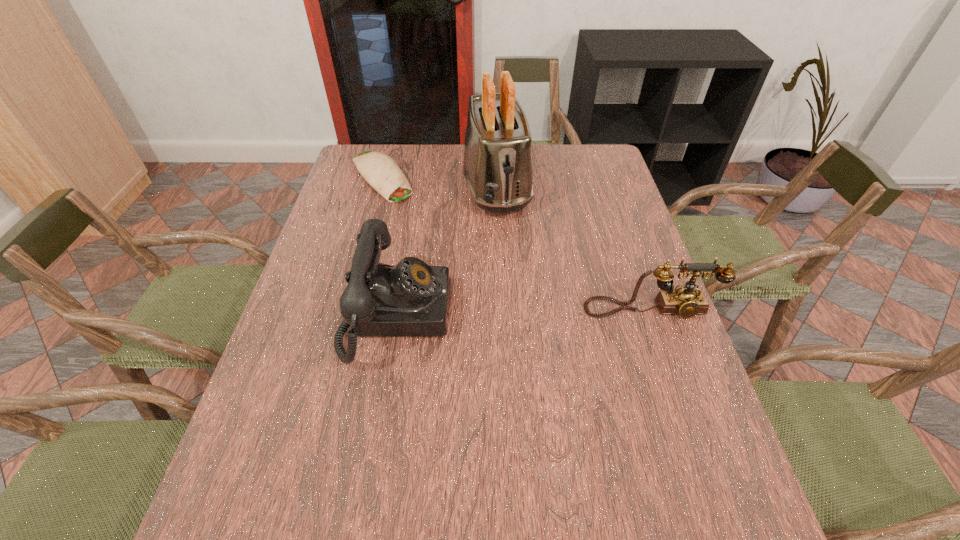
The width and height of the screenshot is (960, 540). I want to click on vacant region located 0.110m on the side of the third object from left to right with the control lever, so click(x=509, y=247).

I want to click on vacant area situated on the side of the third object from left to right with the control lever, so click(511, 252).

I want to click on vacant space located 0.090m at the bitten end of the burrito, so click(408, 214).

This screenshot has height=540, width=960. What are the coordinates of `vacant space situated at the bitten end of the burrito` in the screenshot? It's located at (x=438, y=247).

You are a GUI agent. You are given a task and a screenshot of the screen. Output one action in this format:
    pyautogui.click(x=<x>, y=<y>)
    Task: Click on the free space located 0.190m at the bitten end of the burrito
    Image resolution: width=960 pixels, height=540 pixels.
    Given the screenshot: What is the action you would take?
    pyautogui.click(x=423, y=232)

Identify the location of toaster situated at the far edge. (497, 166).

In order to click on burrito located at the far edge in this screenshot , I will do 378,169.

Identify the location of telephone present at the left edge. The image size is (960, 540). (411, 299).

At what (x,y) coordinates should I click in order to perform the action: click on burrito that is at the left edge. Please return your answer as a coordinate pair (x, y). This screenshot has width=960, height=540. Looking at the image, I should click on (378, 169).

Identify the location of object that is positioned at the right edge. The width and height of the screenshot is (960, 540). (685, 301).